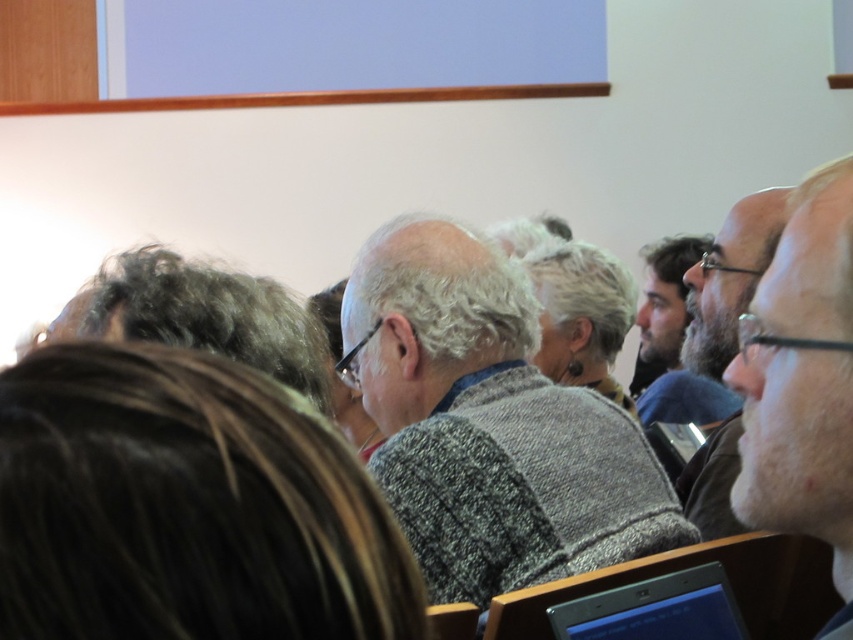
You are sitting in the auditorium and want to see both the smooth skin face at right and the dark brown beard at center clearly. Which one of them is closer to the front of the auditorium?

The smooth skin face at right is not as tall as the dark brown beard at center, so the dark brown beard at center is closer to the front of the auditorium.

In the auditorium scene, there are two people visible in the foreground. One has a smooth skin face at right and the other has a dark brown beard at center. Which of these two individuals appears smaller in the image?

The smooth skin face at right appears smaller compared to the dark brown beard at center because it has a smaller size.